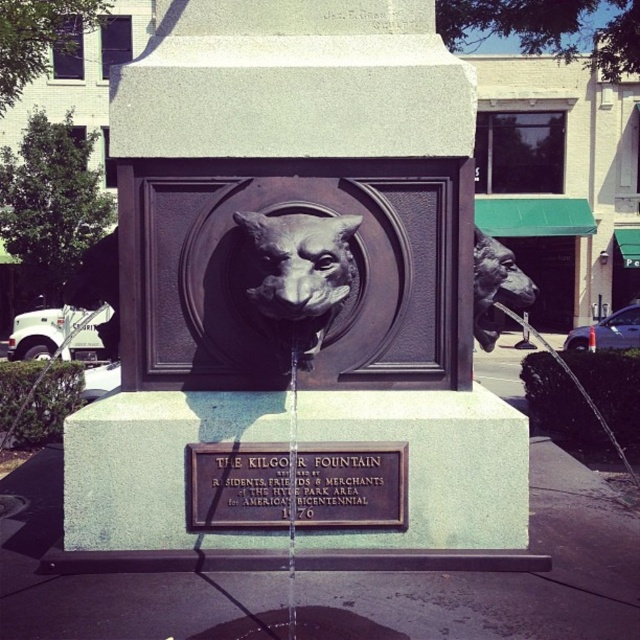
Question: Can you confirm if bronze statue at center is wider than bronze plaque at center?

Choices:
 (A) yes
 (B) no

Answer: (A)

Question: Can you confirm if bronze plaque at center is thinner than bronze/textured animal head at center?

Choices:
 (A) no
 (B) yes

Answer: (A)

Question: Which object is farther from the camera taking this photo?

Choices:
 (A) bronze plaque at center
 (B) bronze/textured animal head at center
 (C) bronze statue at center
 (D) bronze statue at right

Answer: (D)

Question: Which point is farther to the camera?

Choices:
 (A) bronze/textured animal head at center
 (B) bronze statue at right
 (C) bronze statue at center
 (D) bronze/brass lion head at center

Answer: (D)

Question: Which of the following is the farthest from the observer?

Choices:
 (A) (282, 502)
 (B) (253, 340)

Answer: (B)

Question: Can you confirm if bronze statue at right is thinner than bronze/brass lion head at center?

Choices:
 (A) yes
 (B) no

Answer: (A)